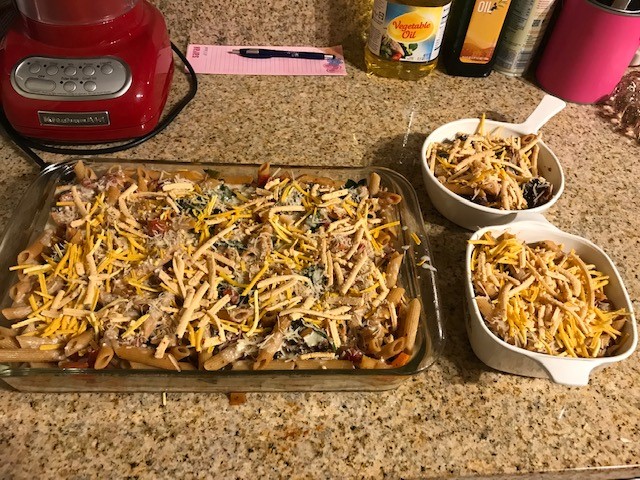
The height and width of the screenshot is (480, 640). In order to click on handles in this screenshot , I will do `click(545, 108)`, `click(532, 220)`, `click(570, 377)`.